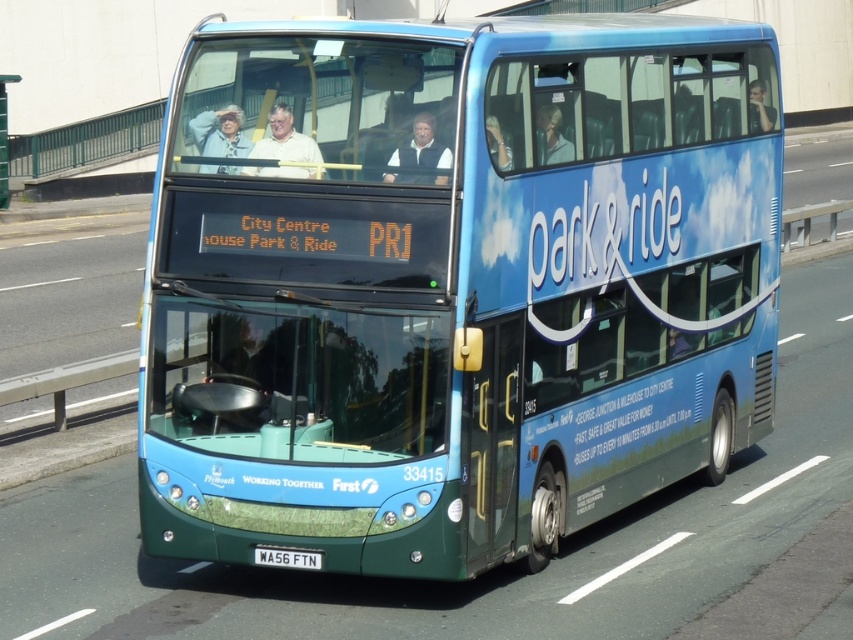
Looking at this image, you are standing on the sidewalk and looking at the double decker bus. There are two points marked on the bus, point A at coordinates point [399,113] and point B at coordinates point [265,554]. Which point is closer to you?

Point point [399,113] is closer to the viewer than point point [265,554].

You are a pedestrian standing on the sidewalk next to the double decker bus. You notice the matte white shirt at upper center and the black plastic license plate at lower center. Which object is wider?

The matte white shirt at upper center might be wider than the black plastic license plate at lower center.

You are a passenger on the double decker bus and you are wearing a matte white shirt at upper center. You want to place your phone on the seat next to you. The seat is at point 0.219, 0.335. Is your shirt at upper center in the way?

The matte white shirt at upper center is located at point [285,140], so it is exactly at the seat where you want to place your phone. Therefore, the shirt is in the way.